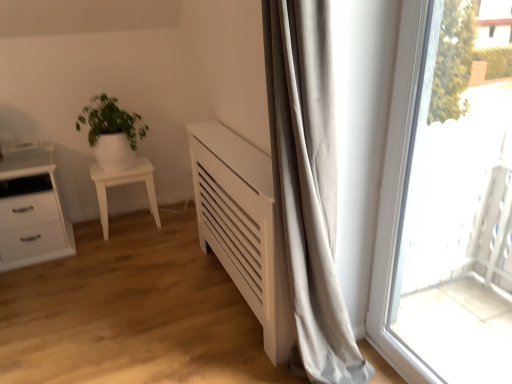
Question: From a real-world perspective, is transparent glass window at right physically located above or below white glossy pot at left?

Choices:
 (A) below
 (B) above

Answer: (B)

Question: Based on their sizes in the image, would you say transparent glass window at right is bigger or smaller than white glossy pot at left?

Choices:
 (A) small
 (B) big

Answer: (A)

Question: Based on their relative distances, which object is farther from the white glossy pot at left?

Choices:
 (A) white glossy side table at left
 (B) white glossy chest of drawers at left
 (C) transparent glass window at right

Answer: (C)

Question: Based on their relative distances, which object is nearer to the transparent glass window at right?

Choices:
 (A) white glossy chest of drawers at left
 (B) white glossy side table at left
 (C) white glossy pot at left

Answer: (B)